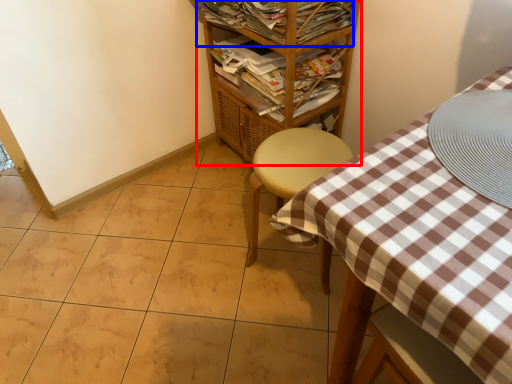
Question: Which object appears closest to the camera in this image, shelf (highlighted by a red box) or magazine (highlighted by a blue box)?

Choices:
 (A) shelf
 (B) magazine

Answer: (A)